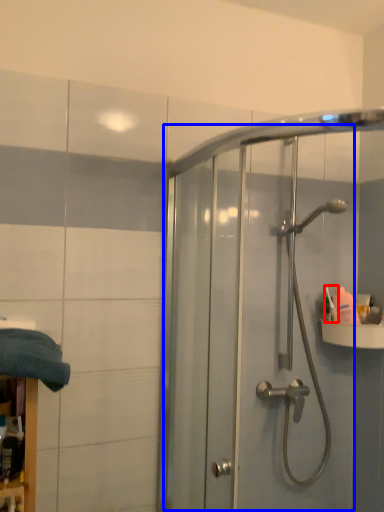
Question: Which point is closer to the camera, toiletry (highlighted by a red box) or screen door (highlighted by a blue box)?

Choices:
 (A) toiletry
 (B) screen door

Answer: (B)